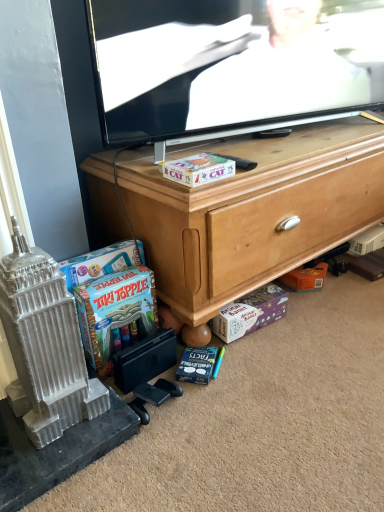
Find the location of a particular element. This screenshot has height=512, width=384. free location to the right of blue matte book at lower center is located at coordinates (256, 369).